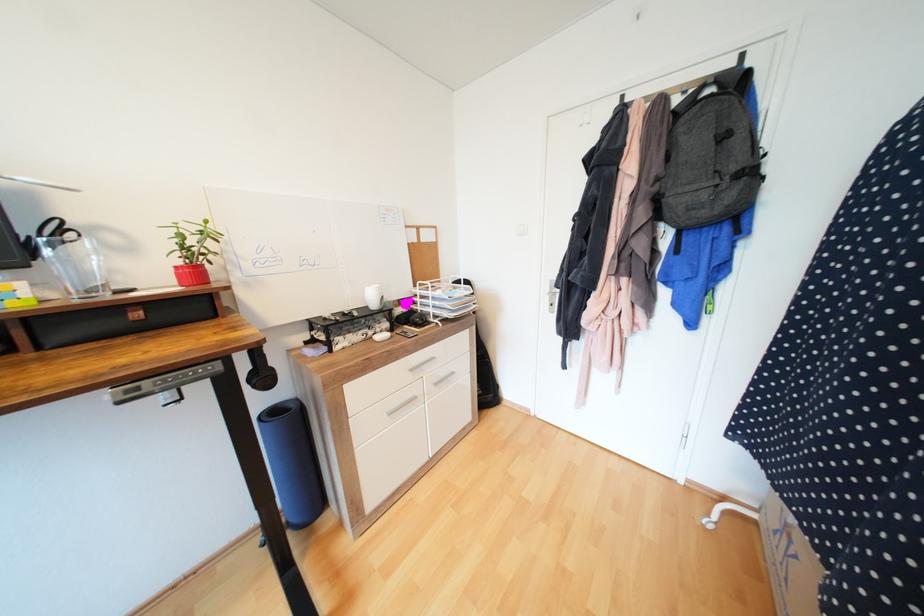
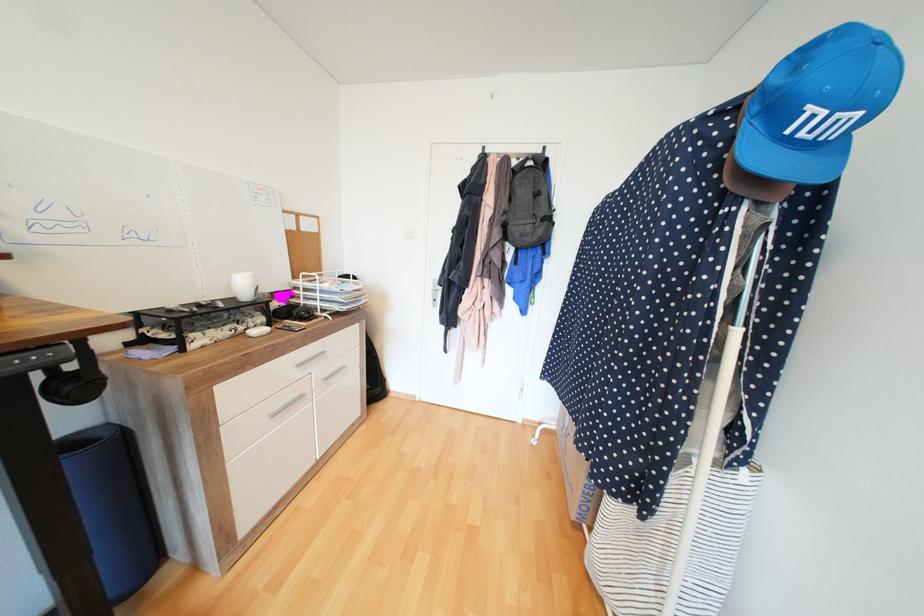
Locate, in the second image, the point that corresponds to pixel 424 309 in the first image.

(308, 302)